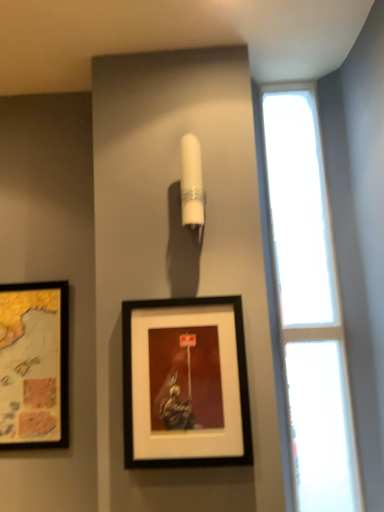
Question: From a real-world perspective, is transparent glass window at right located beneath matte black picture frame at left, positioned as the second picture frame in front-to-back order?

Choices:
 (A) no
 (B) yes

Answer: (A)

Question: Is transparent glass window at right to the left of matte black picture frame at left, acting as the first picture frame starting from the back, from the viewer's perspective?

Choices:
 (A) yes
 (B) no

Answer: (B)

Question: Can you confirm if transparent glass window at right is positioned to the right of matte black picture frame at left, which is counted as the 1th picture frame, starting from the left?

Choices:
 (A) yes
 (B) no

Answer: (A)

Question: Can you confirm if transparent glass window at right is bigger than matte black picture frame at left, acting as the first picture frame starting from the back?

Choices:
 (A) yes
 (B) no

Answer: (A)

Question: Is transparent glass window at right taller than matte black picture frame at left, positioned as the second picture frame in front-to-back order?

Choices:
 (A) no
 (B) yes

Answer: (B)

Question: Is matte black picture frame at left, positioned as the second picture frame in front-to-back order, inside transparent glass window at right?

Choices:
 (A) yes
 (B) no

Answer: (B)

Question: Is the depth of black matte picture frame at center, acting as the 1th picture frame starting from the front, less than that of transparent glass window at right?

Choices:
 (A) no
 (B) yes

Answer: (B)

Question: Considering the relative sizes of black matte picture frame at center, which appears as the second picture frame when viewed from the back, and transparent glass window at right in the image provided, is black matte picture frame at center, which appears as the second picture frame when viewed from the back, thinner than transparent glass window at right?

Choices:
 (A) yes
 (B) no

Answer: (A)

Question: Is transparent glass window at right completely or partially inside black matte picture frame at center, the 2th picture frame viewed from the left?

Choices:
 (A) yes
 (B) no

Answer: (B)

Question: Is black matte picture frame at center, acting as the 1th picture frame starting from the front, facing towards transparent glass window at right?

Choices:
 (A) no
 (B) yes

Answer: (A)

Question: From the image's perspective, would you say black matte picture frame at center, the 1th picture frame when ordered from right to left, is shown under transparent glass window at right?

Choices:
 (A) yes
 (B) no

Answer: (A)

Question: Is black matte picture frame at center, the 1th picture frame when ordered from right to left, wider than transparent glass window at right?

Choices:
 (A) yes
 (B) no

Answer: (B)

Question: From the image's perspective, is transparent glass window at right on black matte picture frame at center, acting as the 1th picture frame starting from the front?

Choices:
 (A) no
 (B) yes

Answer: (B)